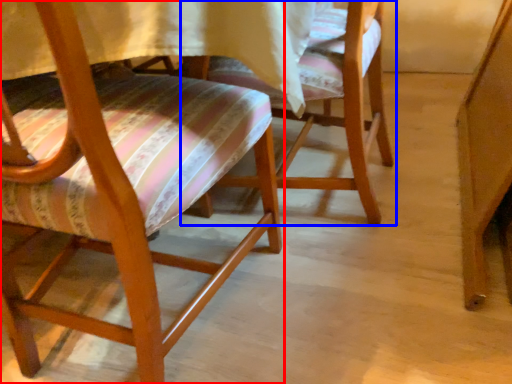
Question: Which object is closer to the camera taking this photo, chair (highlighted by a red box) or chair (highlighted by a blue box)?

Choices:
 (A) chair
 (B) chair

Answer: (A)